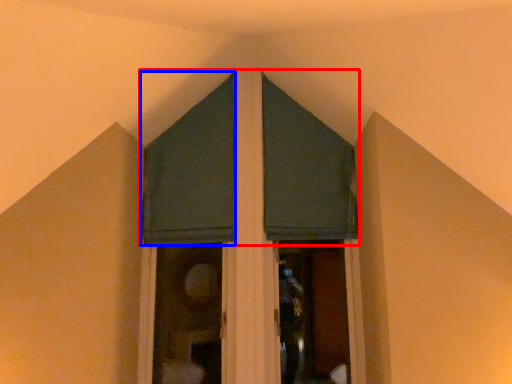
Question: Which object appears farthest to the camera in this image, curtain (highlighted by a red box) or curtain (highlighted by a blue box)?

Choices:
 (A) curtain
 (B) curtain

Answer: (B)